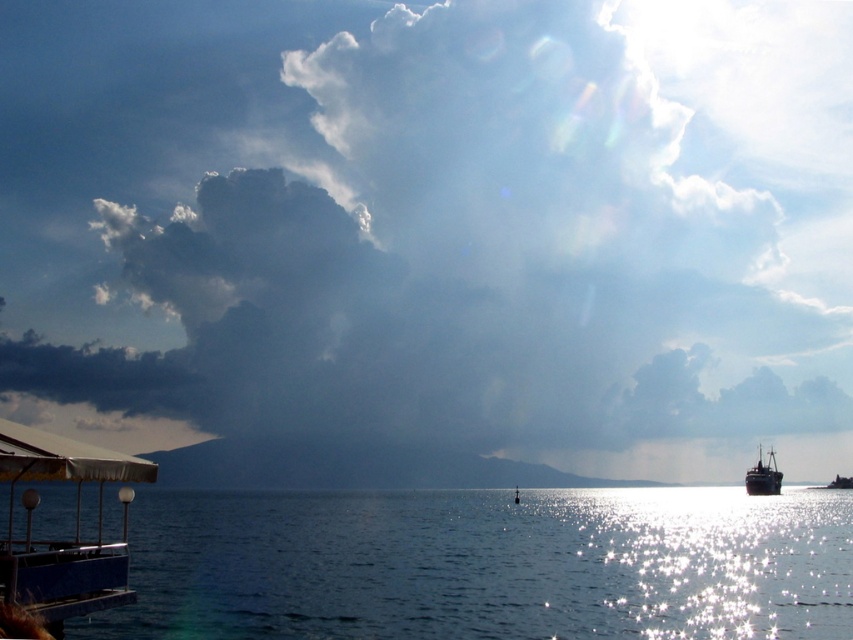
Between dark gray cloud at upper center and white matte canopy at lower left, which one has less height?

With less height is white matte canopy at lower left.

Between dark gray cloud at upper center and white matte canopy at lower left, which one appears on the left side from the viewer's perspective?

From the viewer's perspective, dark gray cloud at upper center appears more on the left side.

Find the location of a particular element. This screenshot has width=853, height=640. dark gray cloud at upper center is located at coordinates (428, 209).

Does dark gray cloud at upper center appear on the left side of blue water at lower left?

Correct, you'll find dark gray cloud at upper center to the left of blue water at lower left.

Describe the element at coordinates (428, 209) in the screenshot. I see `dark gray cloud at upper center` at that location.

I want to click on dark gray cloud at upper center, so coord(428,209).

Who is taller, dark gray cloud at upper center or shiny dark wood ship at right?

dark gray cloud at upper center is taller.

Is dark gray cloud at upper center wider than shiny dark wood ship at right?

Yes, dark gray cloud at upper center is wider than shiny dark wood ship at right.

The height and width of the screenshot is (640, 853). Identify the location of dark gray cloud at upper center. (428, 209).